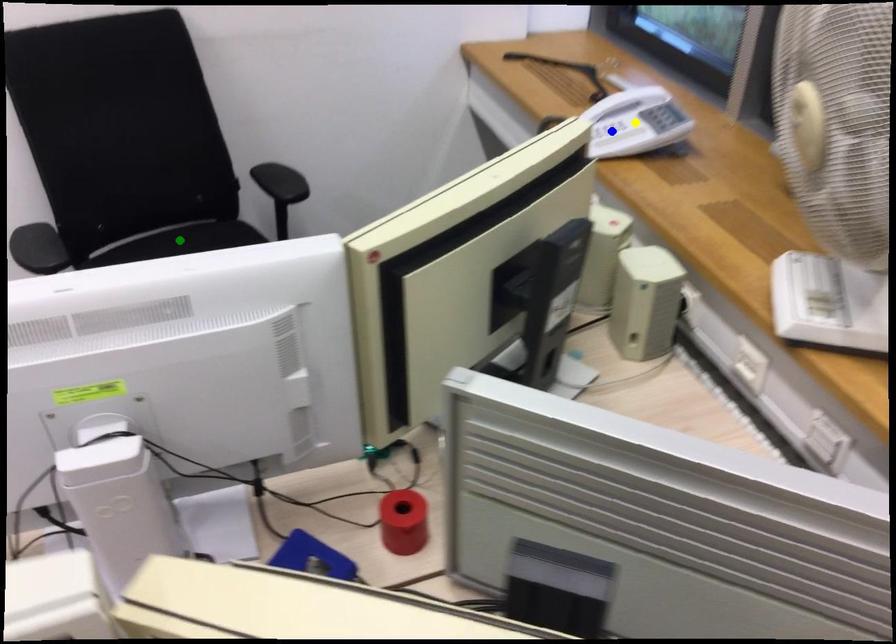
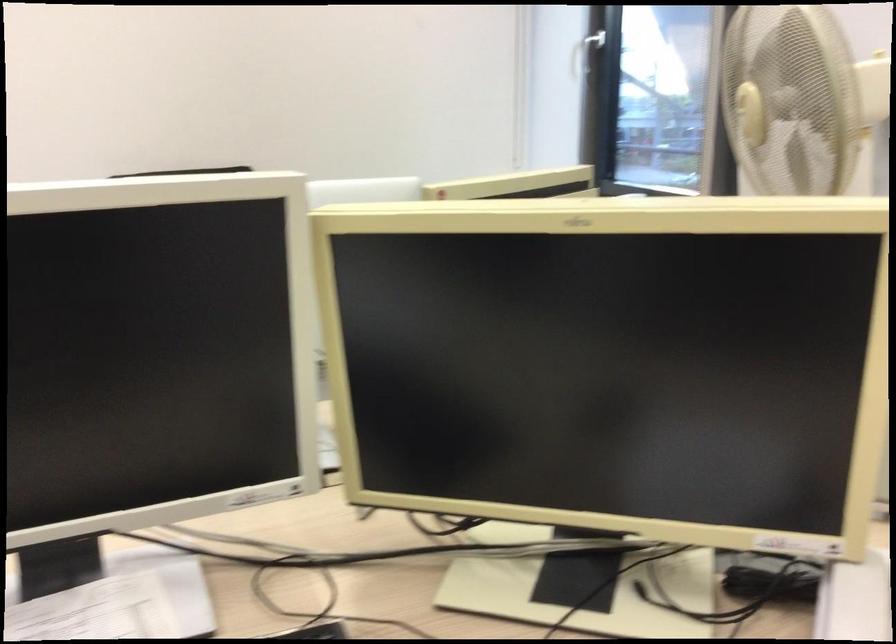
I am providing you with two images of the same scene from different viewpoints. Three points are marked in image1. Which point corresponds to a part or object that is occluded in image2?In image1, three points are marked. Which of them correspond to a part or object that is occluded in image2?Among the three points shown in image1, which one corresponds to a part or object that is no longer visible due to occlusion in image2?

yellow point, green point, blue point